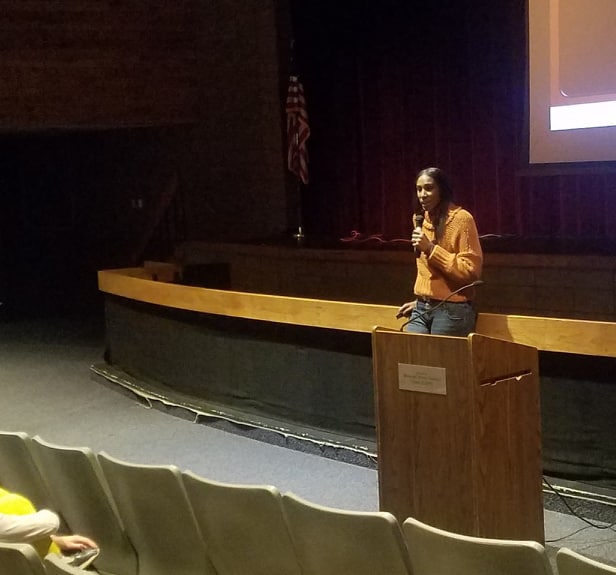
At what (x,y) coordinates should I click in order to perform the action: click on cord. Please return your answer as a coordinate pair (x, y). Image resolution: width=616 pixels, height=575 pixels. Looking at the image, I should click on (570, 505).